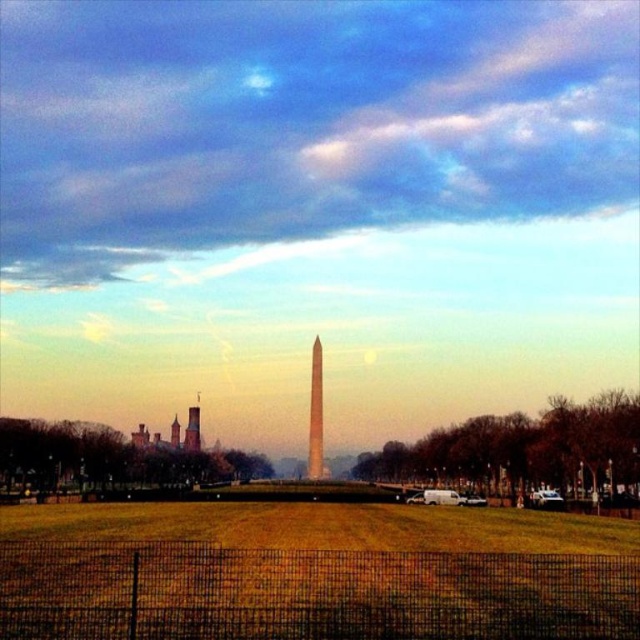
You are a photographer planning to capture the Washington Monument against the cloudy sky at upper center. Given that the smooth glass obelisk at center is in front of the sky, will the monument be fully visible in the photo?

The cloudy sky at upper center is taller than the smooth glass obelisk at center, so the monument will be fully visible as the sky extends above the obelisk.

You are standing at the fence near the bottom edge of the image. You see the yellow grass at center and the smooth glass obelisk at center. Which object is wider from your perspective?

The yellow grass at center is wider than the smooth glass obelisk at center from your perspective.